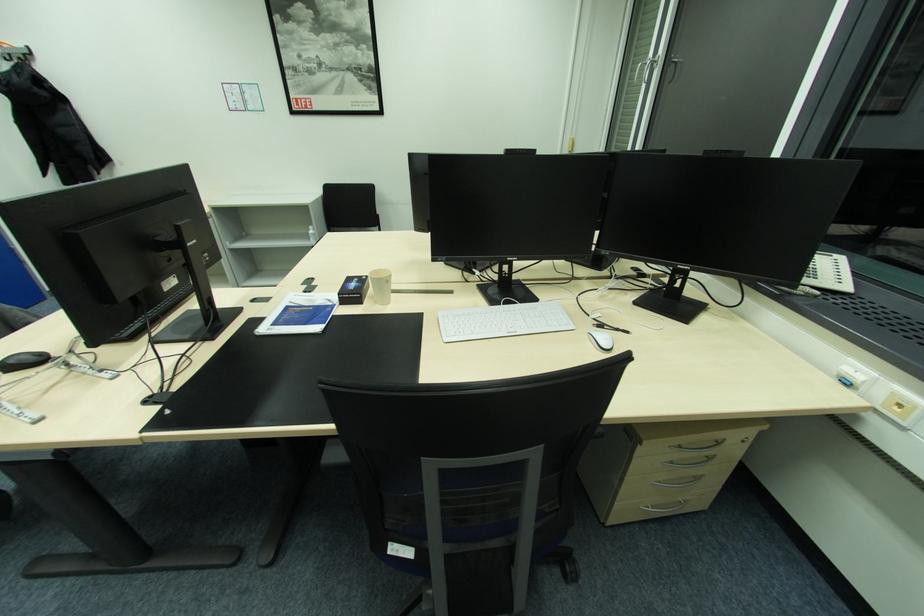
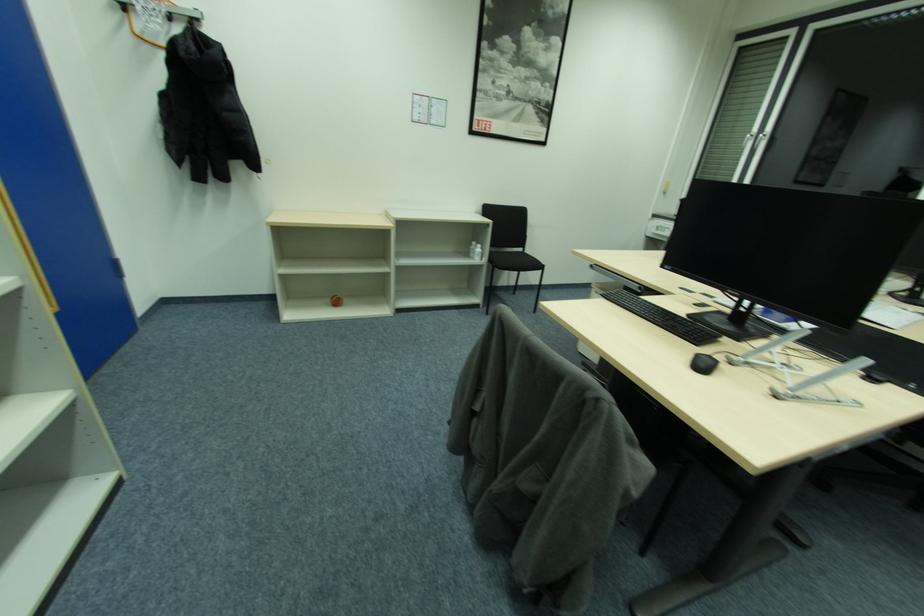
Question: In a continuous first-person perspective shot, in which direction is the camera moving?

Choices:
 (A) Left
 (B) Right
 (C) Forward
 (D) Backward

Answer: (A)